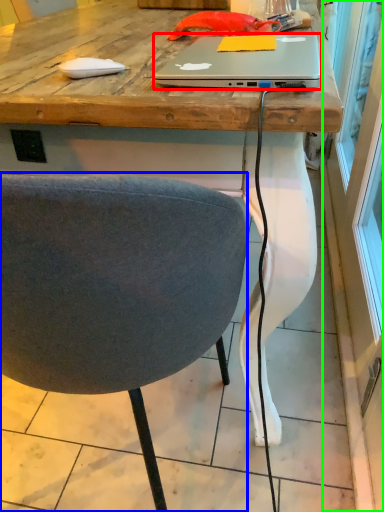
Question: Considering the real-world distances, which object is closest to laptop (highlighted by a red box)? chair (highlighted by a blue box) or screen door (highlighted by a green box).

Choices:
 (A) chair
 (B) screen door

Answer: (A)